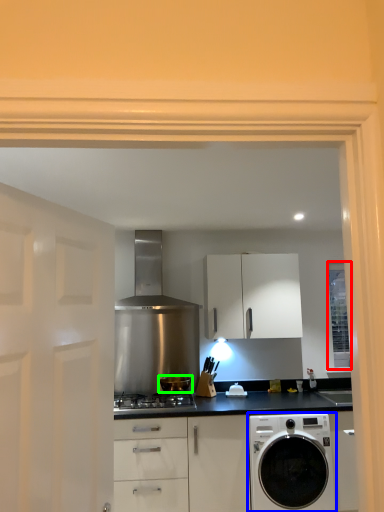
Question: Which object is the closest to the window (highlighted by a red box)? Choose among these: washing machine (highlighted by a blue box) or kitchen appliance (highlighted by a green box).

Choices:
 (A) washing machine
 (B) kitchen appliance

Answer: (A)